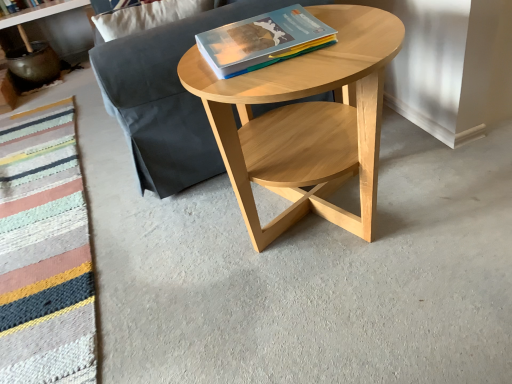
Find the location of a particular element. This screenshot has width=512, height=384. vacant region below natural wood coffee table at center (from a real-world perspective) is located at coordinates coord(315,241).